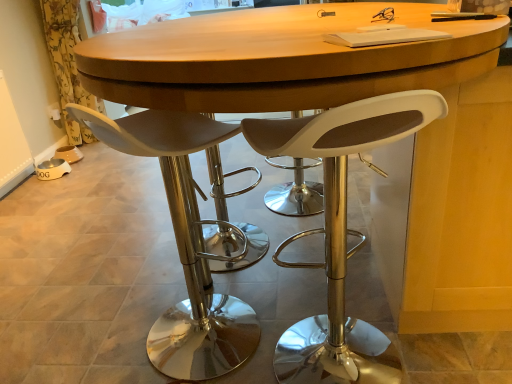
The image size is (512, 384). Find the location of `vacant region to the left of white matte stool at center, acting as the second chair starting from the right`. vacant region to the left of white matte stool at center, acting as the second chair starting from the right is located at coordinates (103, 336).